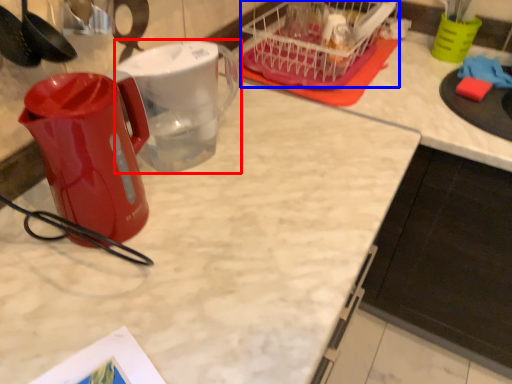
Question: Which point is closer to the camera, pitcher (highlighted by a red box) or basket (highlighted by a blue box)?

Choices:
 (A) pitcher
 (B) basket

Answer: (A)